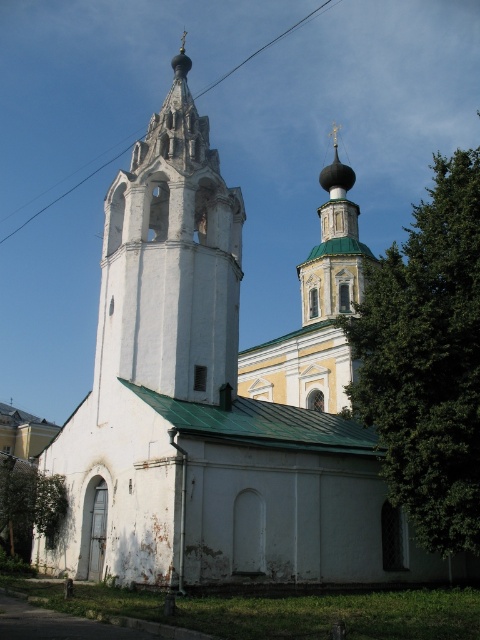
You are standing in front of the church and want to take a photo of the green leafy tree at upper right and the white stone bell tower at center. Which object is positioned more to the east if the church faces north?

The green leafy tree at upper right is positioned more to the east because it is to the right of the white stone bell tower at center, and since the church faces north, the right side would correspond to the east direction.

Looking at the traditional Russian Orthodox church scene, there is a green leafy tree at upper right and a white stone bell tower at center. Which object is shorter in height?

The green leafy tree at upper right is shorter in height compared to the white stone bell tower at center.

You are an architect examining the traditional Russian Orthodox church. You notice the white stone bell tower at center and the black wire at upper center. Which of these two objects is taller?

The white stone bell tower at center is much taller than the black wire at upper center.